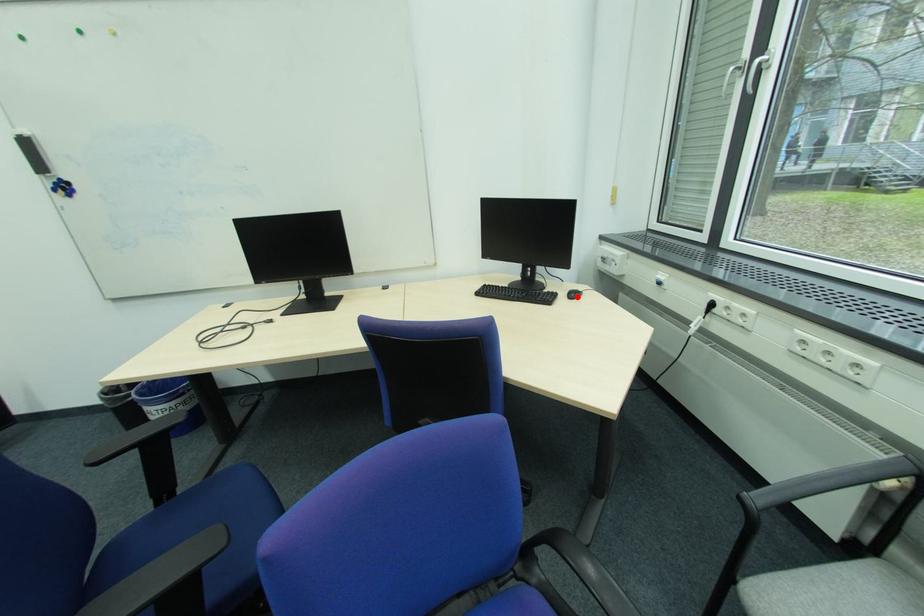
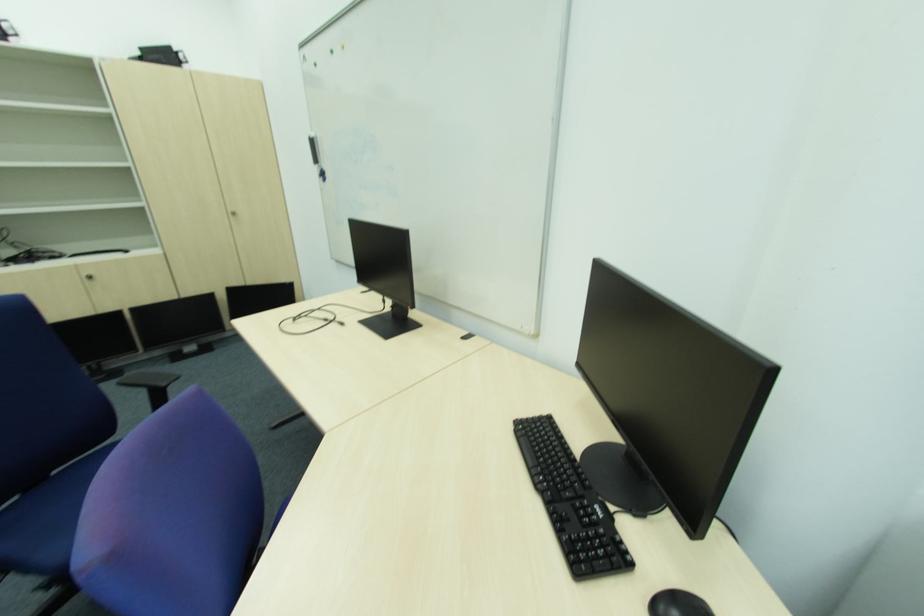
In the second image, find the point that corresponds to the highlighted location in the first image.

(669, 610)